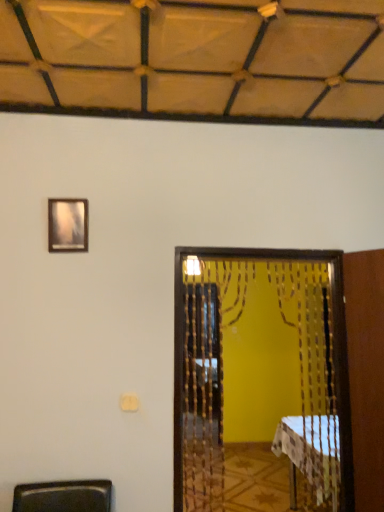
Question: Does point (339, 359) appear closer or farther from the camera than point (74, 207)?

Choices:
 (A) farther
 (B) closer

Answer: (A)

Question: From a real-world perspective, is wooden beaded screen door at center physically located above or below wooden frame at upper left?

Choices:
 (A) above
 (B) below

Answer: (B)

Question: Considering the real-world distances, which object is farthest from the white checkered tablecloth at lower right?

Choices:
 (A) wooden beaded screen door at center
 (B) wooden frame at upper left

Answer: (B)

Question: Which object is positioned closest to the wooden frame at upper left?

Choices:
 (A) white checkered tablecloth at lower right
 (B) wooden beaded screen door at center

Answer: (B)